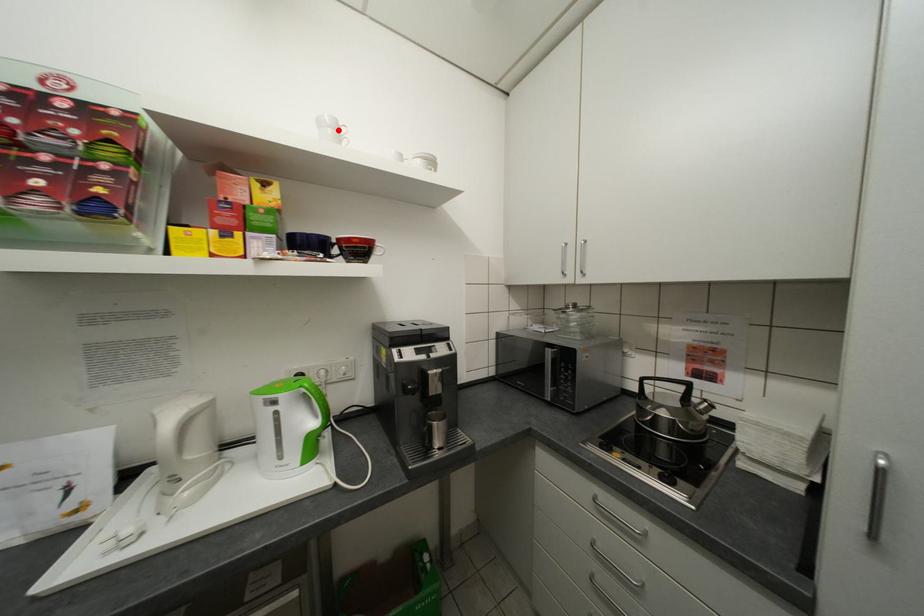
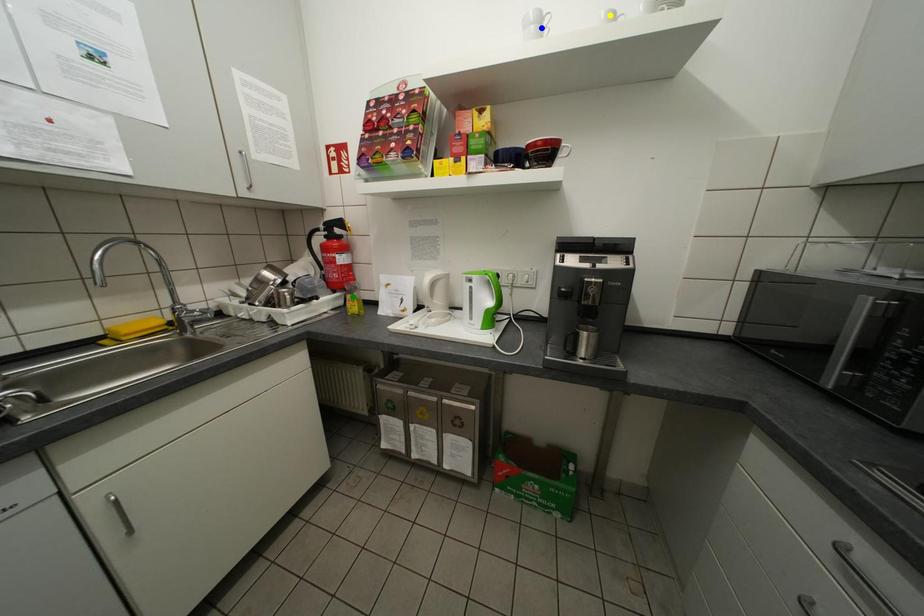
Question: I am providing you with two images of the same scene from different viewpoints. A red point is marked on the first image. You are given multiple points on the second image. Which spot in image 2 lines up with the point in image 1?

Choices:
 (A) green point
 (B) yellow point
 (C) blue point

Answer: (C)